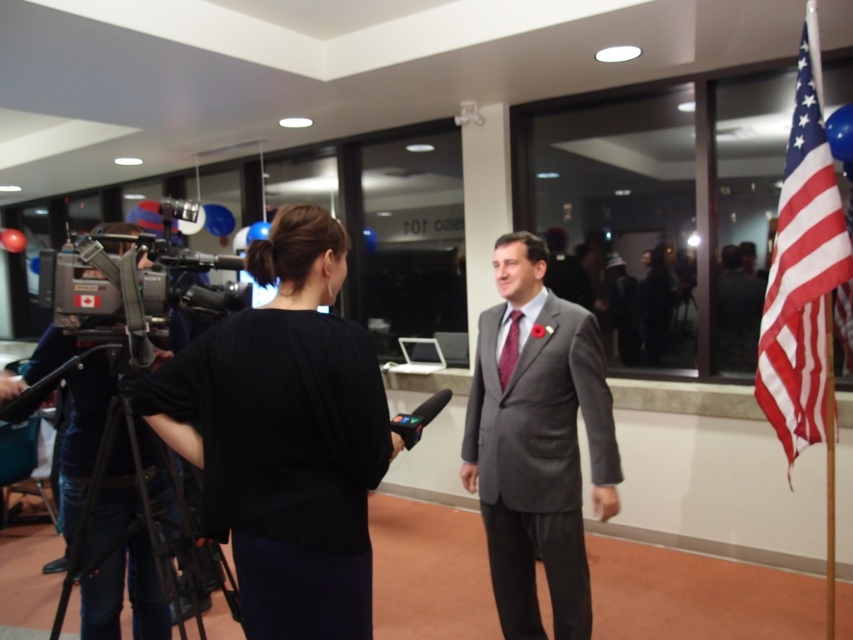
Based on the scene description, which object is positioned lower in the frame between the matte gray suit at center and the red textured tie at center?

The matte gray suit at center is positioned below the red textured tie at center, so it is lower in the frame.